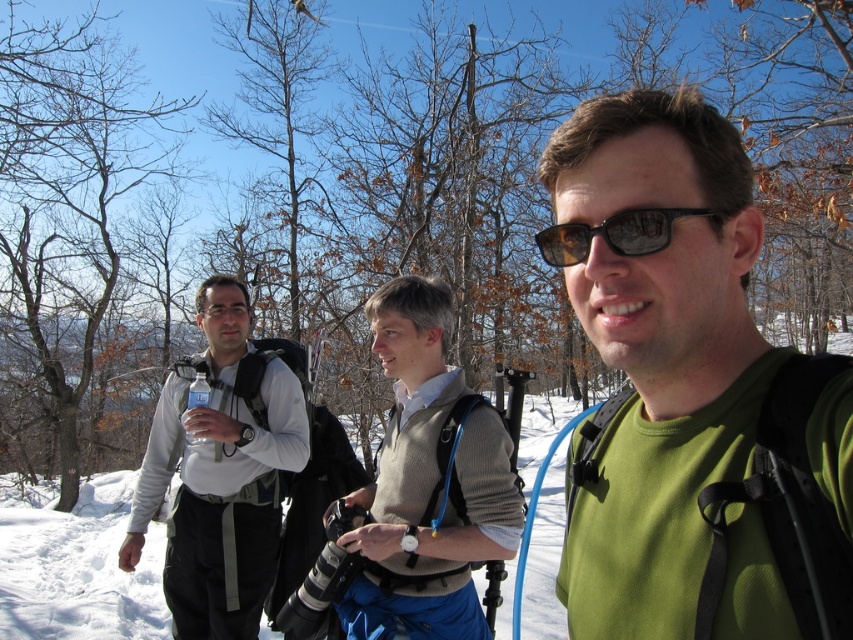
You are a photographer trying to capture the man with the green matte shirt at center and the black reflective sunglasses at center. Which object should you focus on first if you want to ensure both are in focus?

The green matte shirt at center is positioned under black reflective sunglasses at center, so you should focus on the black reflective sunglasses at center first since it is closer to the camera.

You are standing at the point labeled point (589, 244) and want to take a photo of the man in the green shirt on the right side. Is the point labeled point (352, 596) between you and the man in the green shirt?

Point (352, 596) is behind point (589, 244), so it is not between you and the man in the green shirt. You can take the photo without obstruction.